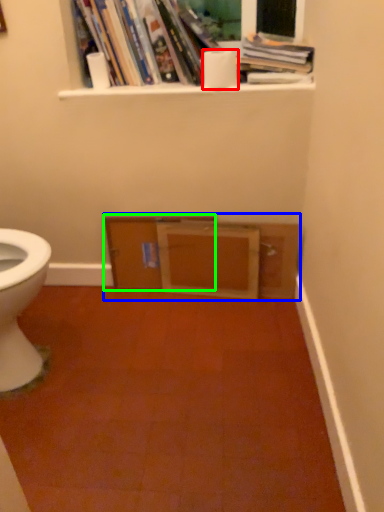
Question: Which object is the closest to the toilet paper (highlighted by a red box)? Choose among these: entertainment center (highlighted by a blue box) or file cabinet (highlighted by a green box).

Choices:
 (A) entertainment center
 (B) file cabinet

Answer: (A)